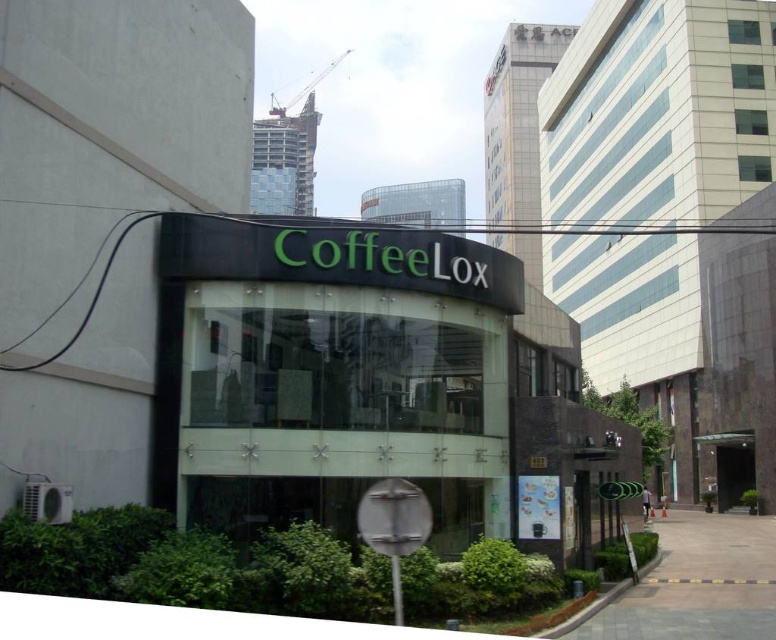
Based on the photo, you are standing at the CoffeeLox storefront and want to place a new bench in the exact center of the paved stone pavement at center. According to the coordinates provided, where should the bench be positioned?

The bench should be placed at the coordinates point (697,582) since that is the exact center of the paved stone pavement at center as specified in the description.

You are a delivery person standing on the paved stone pavement at center and need to reach the entrance of the CoffeeLox store. The entrance is located behind the metallic gray crane at upper center. Can you walk directly to the entrance without going around?

The paved stone pavement at center is in front of the metallic gray crane at upper center, so the crane is between you and the entrance. You will need to go around the crane to reach the entrance.

You are a delivery driver who needs to park your truck in the parking lot behind the CoffeeLox store. Your truck is 60 feet long. Can you safely navigate your truck through the path between the paved stone pavement at center and the metallic gray crane at upper center?

The distance between the paved stone pavement at center and the metallic gray crane at upper center is 753.62 feet, which is significantly longer than your truck length of 60 feet. Therefore, you can safely navigate your truck through the path between the paved stone pavement at center and the metallic gray crane at upper center.